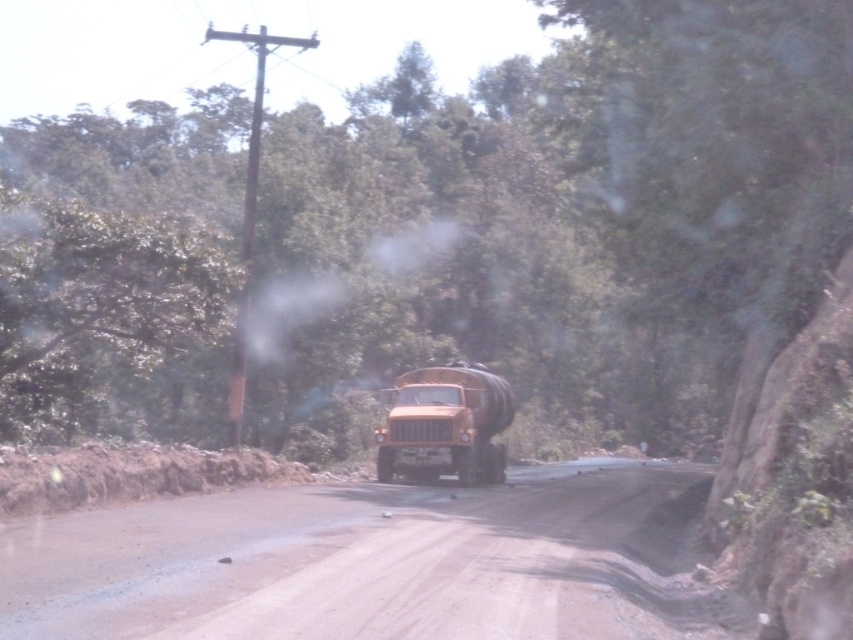
You are a pedestrian standing on the dull brown dirt track at center. You see the matte orange truck at center approaching you. Which direction should you move to get out of the truck driver s line of sight?

The dull brown dirt track at center is in front of the matte orange truck at center, so you should move to the side of the road, either to the left or right, to avoid being in the truck driver s path.

You are a photographer planning to capture the matte orange truck at center and the brown wooden telegraph pole at left in the same frame. Considering their widths, which object will appear narrower in the photo?

The matte orange truck at center will appear narrower in the photo because its width is less than the brown wooden telegraph pole at left.